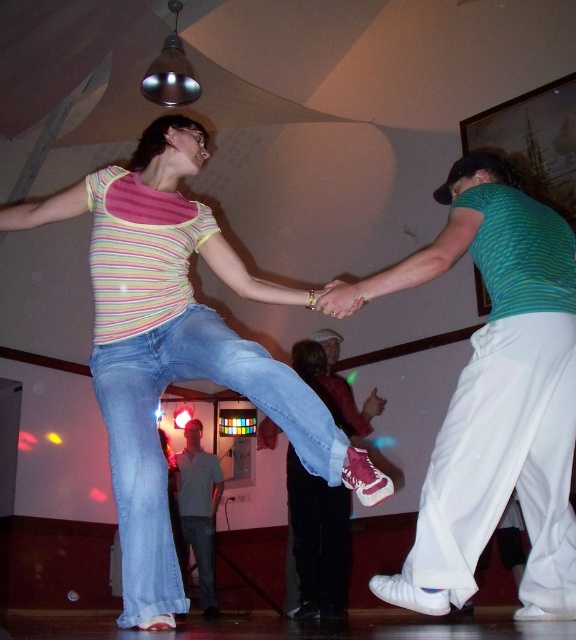
You are a photographer standing in the room. You want to take a photo of the matte green shirt at right and the white cotton pants at lower right. How far apart are these two items in feet?

The matte green shirt at right is 6.95 feet from the white cotton pants at lower right, so the distance between them is 6.95 feet.

You are a photographer setting up a camera to capture the dance pose. The camera has a lens that can only focus on objects within a 1.2 meter width. You need to frame both the matte green shirt at right and the light blue jeans at lower center in the shot. Can the camera lens accommodate both objects based on their widths?

The matte green shirt at right might be wider than light blue jeans at lower center. However, since the exact width difference isn not specified, we cannot confirm if their combined width falls within the 1.2 meter limit. Further measurement is needed.

You are a fashion designer observing the dance scene. You need to create a new outfit that matches the proportions of the existing clothing items. Which clothing item has a greater width when comparing the matte green shirt at right and the white cotton pants at lower right?

The matte green shirt at right has a greater width than the white cotton pants at lower right according to the description.